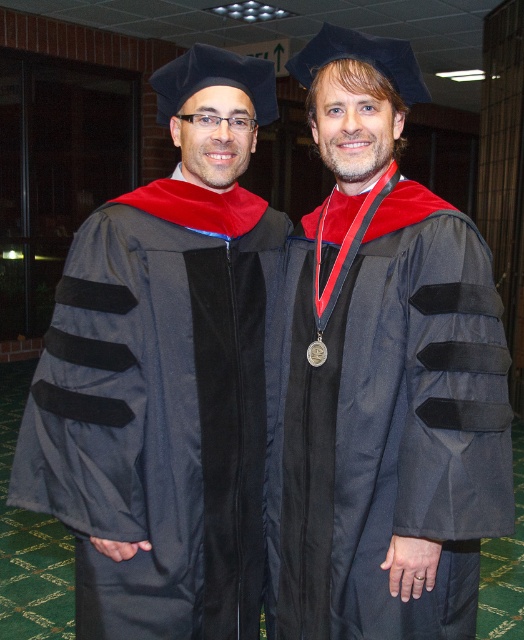
Question: Which object appears farthest from the camera in this image?

Choices:
 (A) velvet black graduation gown at left
 (B) matte black graduation gown at center

Answer: (A)

Question: Which object appears closest to the camera in this image?

Choices:
 (A) matte black graduation gown at center
 (B) velvet black graduation gown at left

Answer: (A)

Question: Does matte black graduation gown at center appear over velvet black graduation gown at left?

Choices:
 (A) no
 (B) yes

Answer: (B)

Question: Does matte black graduation gown at center have a larger size compared to velvet black graduation gown at left?

Choices:
 (A) yes
 (B) no

Answer: (A)

Question: Which object is farther from the camera taking this photo?

Choices:
 (A) velvet black graduation gown at left
 (B) matte black graduation gown at center

Answer: (A)

Question: Is matte black graduation gown at center above velvet black graduation gown at left?

Choices:
 (A) no
 (B) yes

Answer: (B)